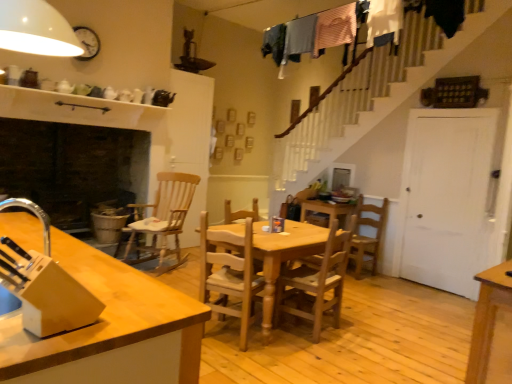
The width and height of the screenshot is (512, 384). I want to click on free space between wooden table at center and wooden chair at center, the 3th chair from the left, so click(303, 342).